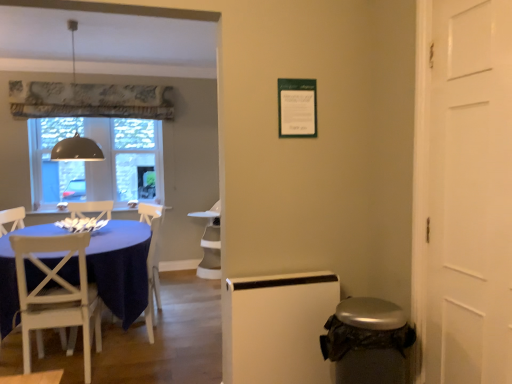
Question: In the image, is white wood chair at left positioned in front of or behind white glossy armchair at center, which ranks as the 1th armchair in back-to-front order?

Choices:
 (A) front
 (B) behind

Answer: (A)

Question: Considering the positions of white wood chair at left and white glossy armchair at center, which ranks as the second armchair in front-to-back order, in the image, is white wood chair at left wider or thinner than white glossy armchair at center, which ranks as the second armchair in front-to-back order,?

Choices:
 (A) wide
 (B) thin

Answer: (B)

Question: Estimate the real-world distances between objects in this image. Which object is farther from the white wood chair at left?

Choices:
 (A) blue fabric table at left
 (B) clear glass window at center
 (C) white glossy armchair at center, which ranks as the 1th armchair in back-to-front order
 (D) white wood chair at left, which ranks as the second armchair in back-to-front order
 (E) matte gray dome at upper left

Answer: (B)

Question: Estimate the real-world distances between objects in this image. Which object is farther from the matte gray dome at upper left?

Choices:
 (A) white wood chair at left
 (B) white glossy armchair at center, which ranks as the second armchair in front-to-back order
 (C) clear glass window at center
 (D) blue fabric table at left
 (E) white wood chair at left, the 1th armchair viewed from the front

Answer: (C)